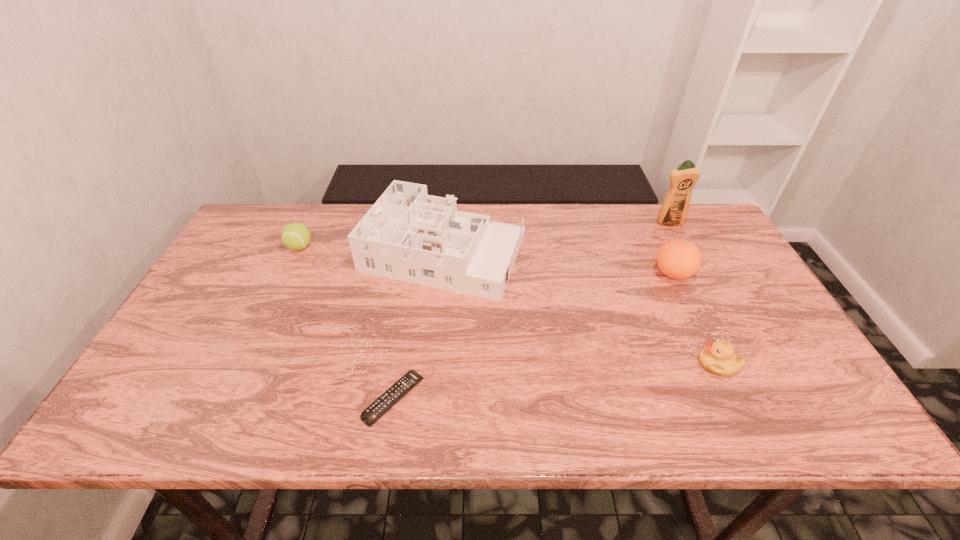
At what (x,y) coordinates should I click in order to perform the action: click on duckling present at the right edge. Please return your answer as a coordinate pair (x, y). The image size is (960, 540). Looking at the image, I should click on (718, 358).

The height and width of the screenshot is (540, 960). I want to click on object that is at the far right corner, so click(674, 210).

I want to click on free point at the far edge, so click(344, 211).

Identify the location of vacant area at the near edge of the desktop. This screenshot has height=540, width=960. (448, 399).

In the image, there is a desktop. At what (x,y) coordinates should I click in order to perform the action: click on vacant space at the left edge. Please return your answer as a coordinate pair (x, y). The height and width of the screenshot is (540, 960). Looking at the image, I should click on (249, 302).

Find the location of a particular element. This screenshot has width=960, height=540. vacant space at the right edge is located at coordinates (795, 388).

Locate an element on the screen. The height and width of the screenshot is (540, 960). blank space at the far left corner is located at coordinates coord(258,217).

The image size is (960, 540). I want to click on free space at the near left corner of the desktop, so click(x=175, y=417).

You are a GUI agent. You are given a task and a screenshot of the screen. Output one action in this format:
    pyautogui.click(x=<x>, y=<y>)
    Task: Click on the vacant area that lies between the leftmost object and the duckling
    
    Given the screenshot: What is the action you would take?
    pyautogui.click(x=509, y=305)

This screenshot has height=540, width=960. I want to click on free space between the duckling and the orange, so click(695, 319).